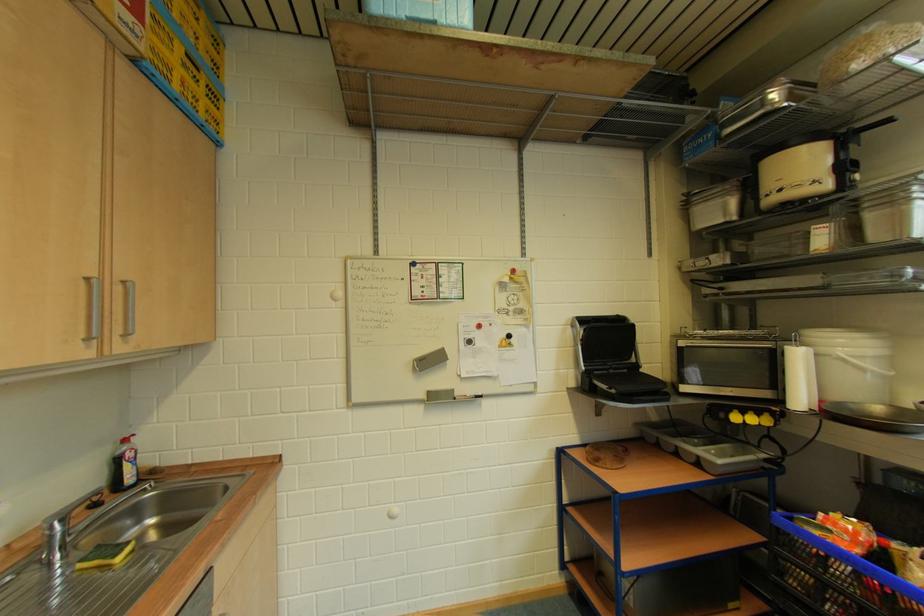
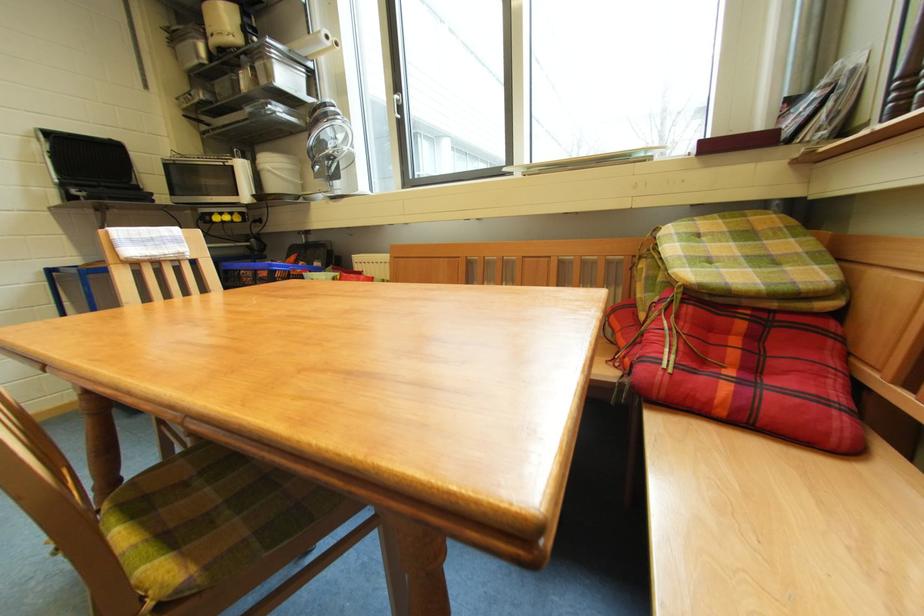
Find the pixel in the second image that matches point 858,360 in the first image.

(281, 171)